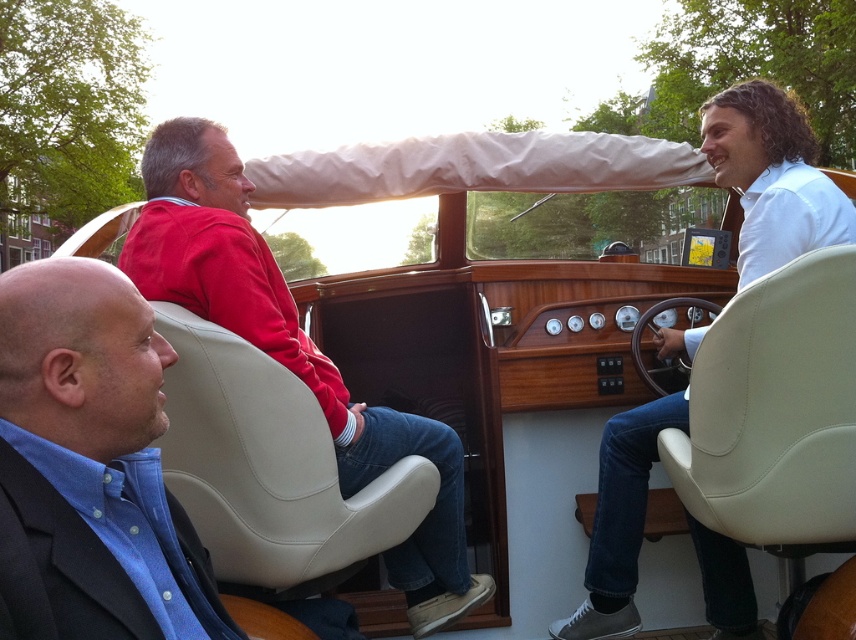
You are a passenger on the vintage motorboat and want to hand a life jacket to the person wearing the matte red sweater at center and the white matte shirt at center. Which one can you reach without moving from your current position?

The matte red sweater at center is closer to the viewer than the white matte shirt at center, so you can reach the person wearing the matte red sweater at center without moving.

Please describe the location of the blue cotton shirt at left in the boat scene using coordinates.

The blue cotton shirt at left is located at point (80, 358).

You are standing on the dock and looking at the boat. You need to hand a life jacket to the person wearing the blue cotton shirt at left and the person wearing the matte red sweater at center. Which person should you hand the life jacket to first based on their position relative to you?

You should hand the life jacket to the blue cotton shirt at left first because it is closer to you than the matte red sweater at center.